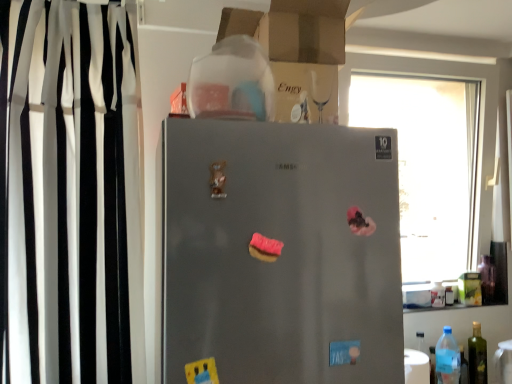
Question: Is blue translucent bottle at lower right, placed as the 3th bottle when sorted from right to left, thinner than black/white striped curtain at left?

Choices:
 (A) yes
 (B) no

Answer: (A)

Question: Is the surface of blue translucent bottle at lower right, placed as the 1th bottle when sorted from left to right, in direct contact with black/white striped curtain at left?

Choices:
 (A) yes
 (B) no

Answer: (B)

Question: From the image's perspective, does blue translucent bottle at lower right, placed as the 1th bottle when sorted from left to right, appear lower than black/white striped curtain at left?

Choices:
 (A) no
 (B) yes

Answer: (B)

Question: Are blue translucent bottle at lower right, placed as the 1th bottle when sorted from left to right, and black/white striped curtain at left far apart?

Choices:
 (A) yes
 (B) no

Answer: (A)

Question: From a real-world perspective, is blue translucent bottle at lower right, the 3th bottle from the back, below black/white striped curtain at left?

Choices:
 (A) no
 (B) yes

Answer: (B)

Question: From a real-world perspective, is blue translucent bottle at lower right, placed as the 1th bottle when sorted from left to right, physically above black/white striped curtain at left?

Choices:
 (A) no
 (B) yes

Answer: (A)

Question: Is black/white striped curtain at left far from transparent plastic bottle at right, which is counted as the 1th bottle, starting from the back?

Choices:
 (A) yes
 (B) no

Answer: (A)

Question: Can you confirm if black/white striped curtain at left is smaller than transparent plastic bottle at right, which is counted as the 1th bottle, starting from the back?

Choices:
 (A) no
 (B) yes

Answer: (A)

Question: Is black/white striped curtain at left oriented away from transparent plastic bottle at right, which is the second bottle in right-to-left order?

Choices:
 (A) yes
 (B) no

Answer: (B)

Question: Is black/white striped curtain at left positioned beyond the bounds of transparent plastic bottle at right, which is counted as the 1th bottle, starting from the back?

Choices:
 (A) yes
 (B) no

Answer: (A)

Question: Is black/white striped curtain at left with transparent plastic bottle at right, placed as the 2th bottle when sorted from left to right?

Choices:
 (A) no
 (B) yes

Answer: (A)

Question: Considering the relative positions of black/white striped curtain at left and transparent plastic bottle at right, which is the third bottle in front-to-back order, in the image provided, is black/white striped curtain at left to the right of transparent plastic bottle at right, which is the third bottle in front-to-back order, from the viewer's perspective?

Choices:
 (A) no
 (B) yes

Answer: (A)

Question: Considering the relative sizes of transparent plastic bottle at right, which is counted as the 1th bottle, starting from the back, and satin silver fridge at center in the image provided, is transparent plastic bottle at right, which is counted as the 1th bottle, starting from the back, thinner than satin silver fridge at center?

Choices:
 (A) yes
 (B) no

Answer: (A)